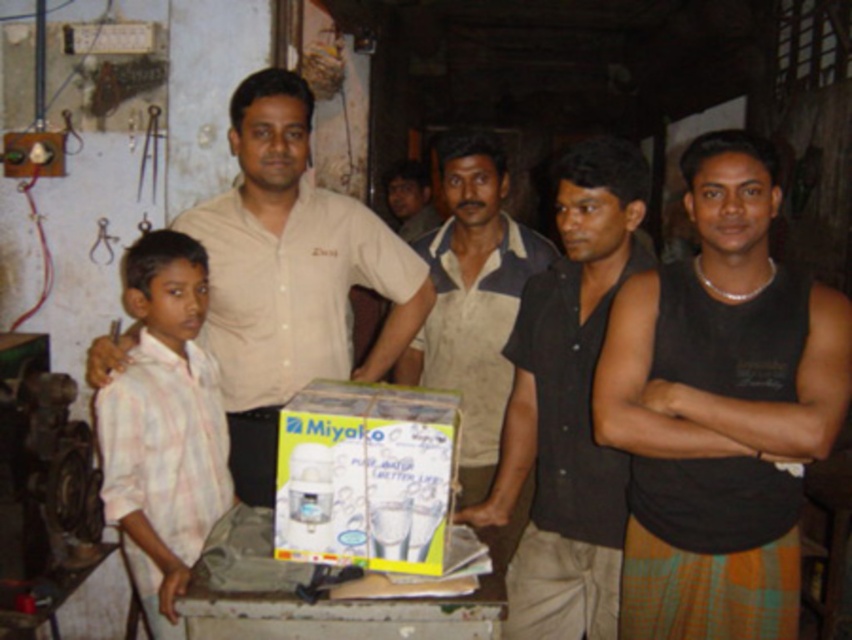
Question: Does black matte shirt at center appear under white textured shirt at center?

Choices:
 (A) yes
 (B) no

Answer: (A)

Question: Which object is closer to the camera taking this photo?

Choices:
 (A) matte beige shirt at center
 (B) black matte shirt at center
 (C) white textured shirt at center

Answer: (B)

Question: Which of the following is the farthest from the observer?

Choices:
 (A) pink striped shirt at left
 (B) white plastic miyako water purifier at center

Answer: (A)

Question: Can you confirm if black sleeveless shirt at right is positioned above matte beige shirt at center?

Choices:
 (A) no
 (B) yes

Answer: (A)

Question: Which point is farther from the camera taking this photo?

Choices:
 (A) pyautogui.click(x=487, y=348)
 (B) pyautogui.click(x=98, y=237)
 (C) pyautogui.click(x=605, y=602)
 (D) pyautogui.click(x=281, y=547)

Answer: (B)

Question: Is black sleeveless shirt at right wider than white textured shirt at center?

Choices:
 (A) no
 (B) yes

Answer: (B)